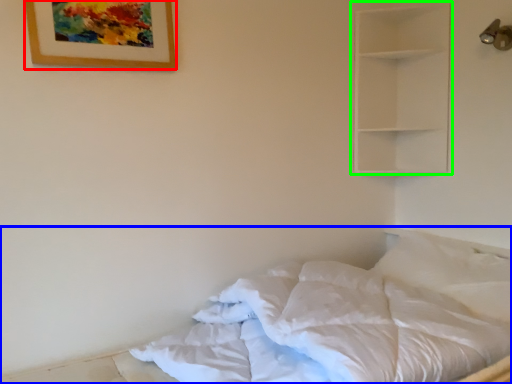
Question: Which object is positioned farthest from picture frame (highlighted by a red box)? Select from bed (highlighted by a blue box) and shelf (highlighted by a green box).

Choices:
 (A) bed
 (B) shelf

Answer: (B)